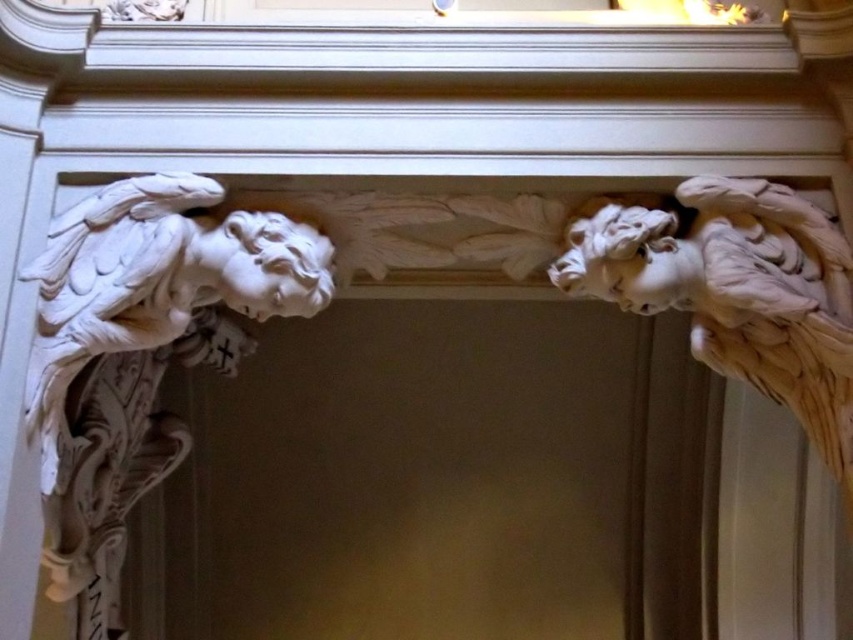
How distant is white marble angel at left from white marble angel at upper right?

1.67 meters

From the picture: Is the position of white marble angel at left less distant than that of white marble angel at upper right?

Yes.

Locate an element on the screen. This screenshot has height=640, width=853. white marble angel at left is located at coordinates (142, 348).